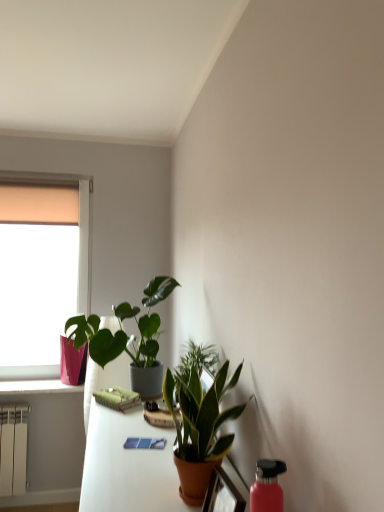
Identify the location of free space that is to the left of pink glossy flowerpot at lower left. The image size is (384, 512). (46, 386).